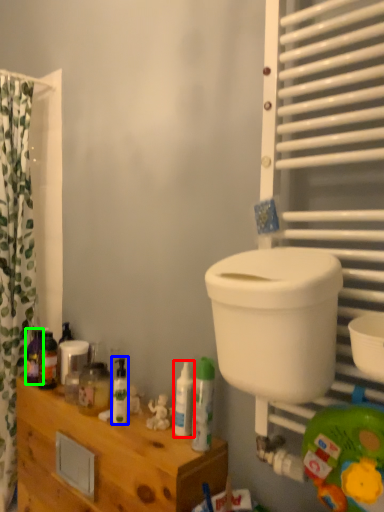
Question: Considering the real-world distances, which object is closest to toiletry (highlighted by a red box)? toiletry (highlighted by a blue box) or toiletry (highlighted by a green box).

Choices:
 (A) toiletry
 (B) toiletry

Answer: (A)